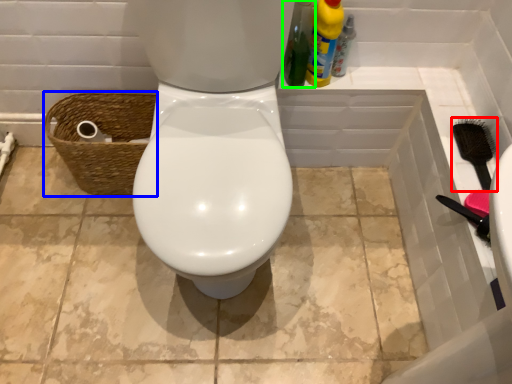
Question: Based on their relative distances, which object is nearer to brush (highlighted by a red box)? Choose from basket (highlighted by a blue box) and cleaning product (highlighted by a green box).

Choices:
 (A) basket
 (B) cleaning product

Answer: (B)